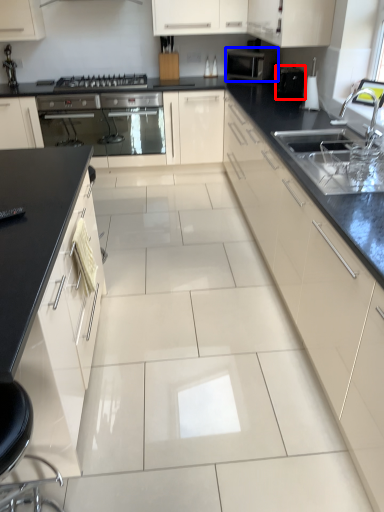
Question: Among these objects, which one is nearest to the camera, appliance (highlighted by a red box) or kitchen appliance (highlighted by a blue box)?

Choices:
 (A) appliance
 (B) kitchen appliance

Answer: (A)